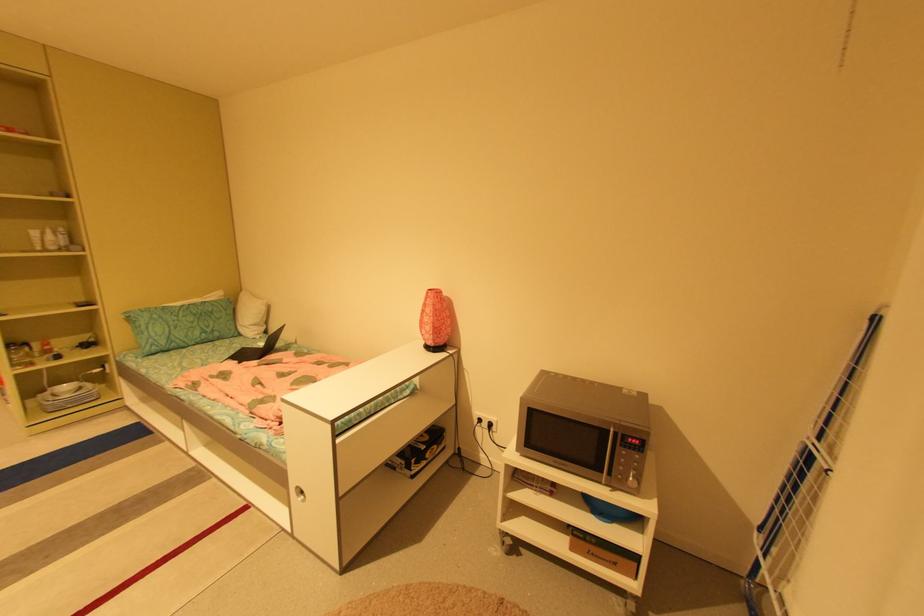
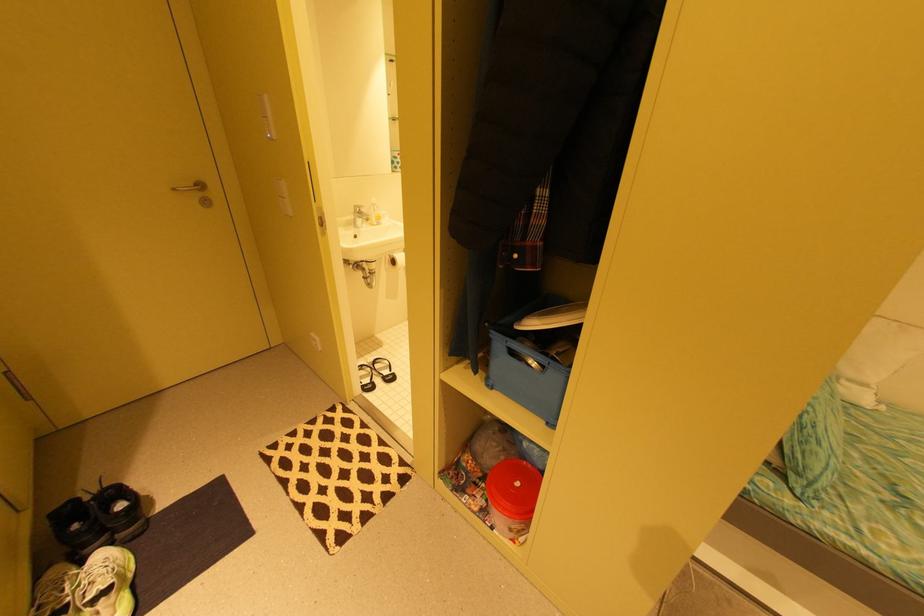
In a continuous first-person perspective shot, in which direction is the camera moving?

The cameraman moved toward left, forward.